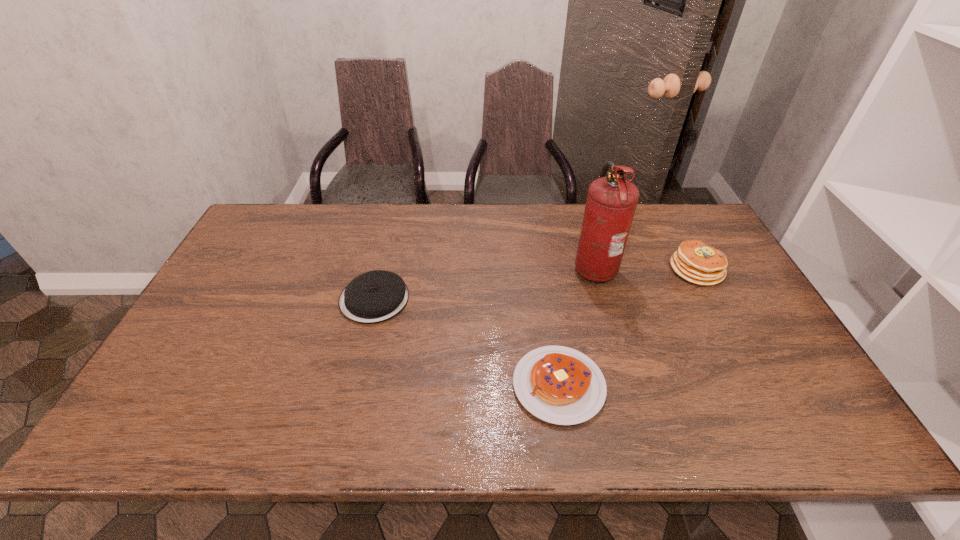
Locate an element on the screen. vacant area situated on the back of the rightmost pancake is located at coordinates pyautogui.click(x=670, y=219).

Where is `free spot located on the right of the leftmost pancake`? free spot located on the right of the leftmost pancake is located at coordinates (500, 299).

The image size is (960, 540). What are the coordinates of `free space located 0.240m on the right of the second pancake from right to left` in the screenshot? It's located at (707, 385).

Find the location of a particular element. The width and height of the screenshot is (960, 540). object at the far edge is located at coordinates (611, 202).

This screenshot has width=960, height=540. What are the coordinates of `object situated at the near edge` in the screenshot? It's located at (560, 385).

Image resolution: width=960 pixels, height=540 pixels. What are the coordinates of `object that is at the right edge` in the screenshot? It's located at 694,261.

Locate an element on the screen. This screenshot has height=540, width=960. vacant space at the far edge is located at coordinates (574, 226).

In the image, there is a desktop. At what (x,y) coordinates should I click in order to perform the action: click on vacant space at the near edge. Please return your answer as a coordinate pair (x, y). This screenshot has width=960, height=540. Looking at the image, I should click on click(514, 410).

I want to click on vacant space at the left edge of the desktop, so click(x=252, y=298).

This screenshot has height=540, width=960. Find the location of `free space at the right edge`. free space at the right edge is located at coordinates (709, 295).